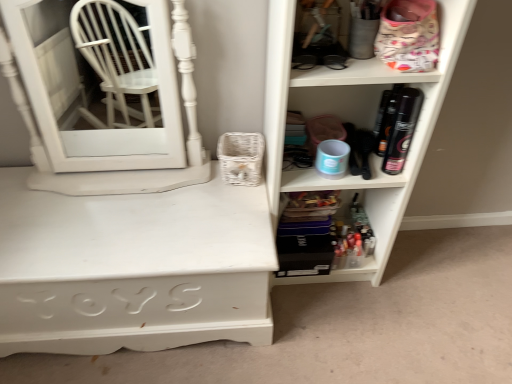
Where is `free spot above white painted wood desk at lower left (from a real-world perspective)`? This screenshot has height=384, width=512. free spot above white painted wood desk at lower left (from a real-world perspective) is located at coordinates (129, 210).